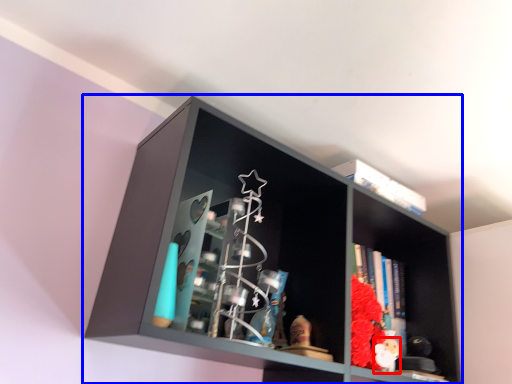
Question: Which object is closer to the camera taking this photo, toy (highlighted by a red box) or shelf (highlighted by a blue box)?

Choices:
 (A) toy
 (B) shelf

Answer: (B)